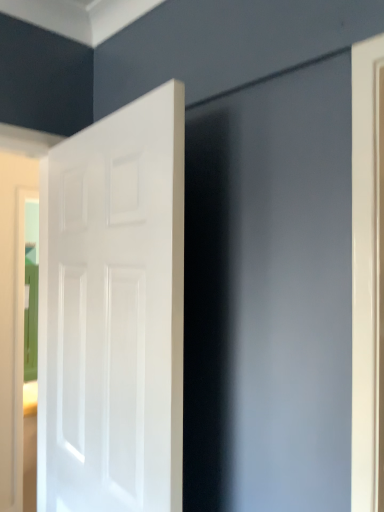
Question: Should I look upward or downward to see white glossy door at left?

Choices:
 (A) up
 (B) down

Answer: (B)